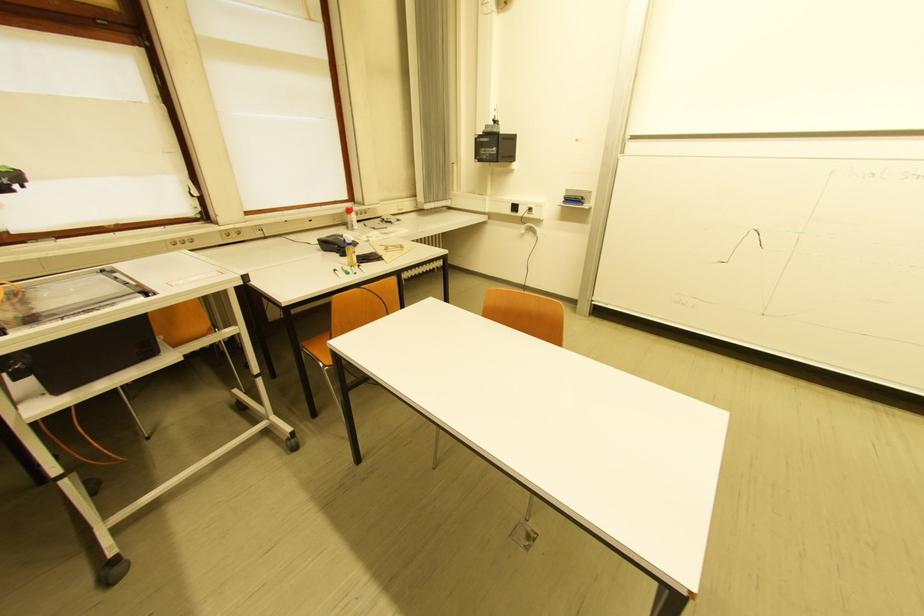
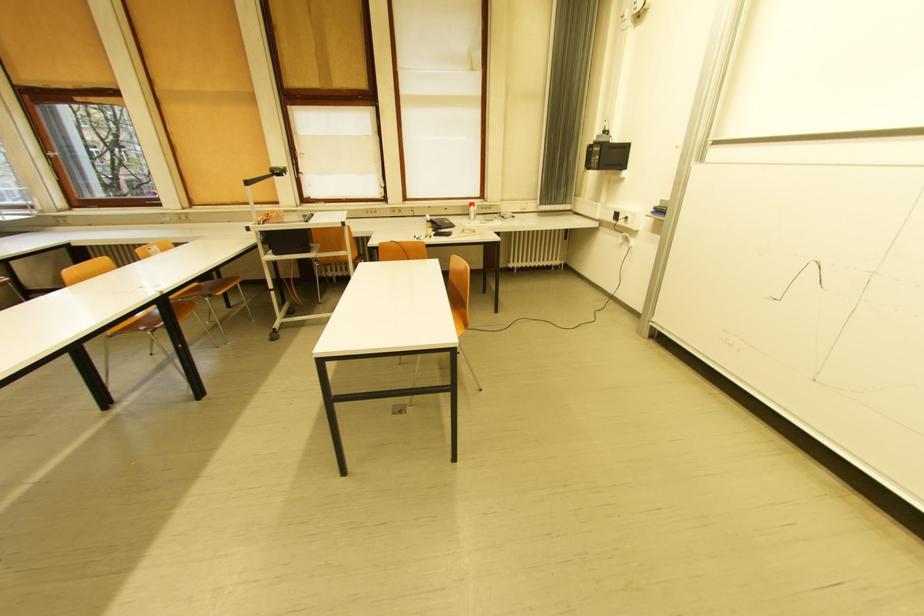
Find the pixel in the second image that matches the point at 482,160 in the first image.

(592, 168)